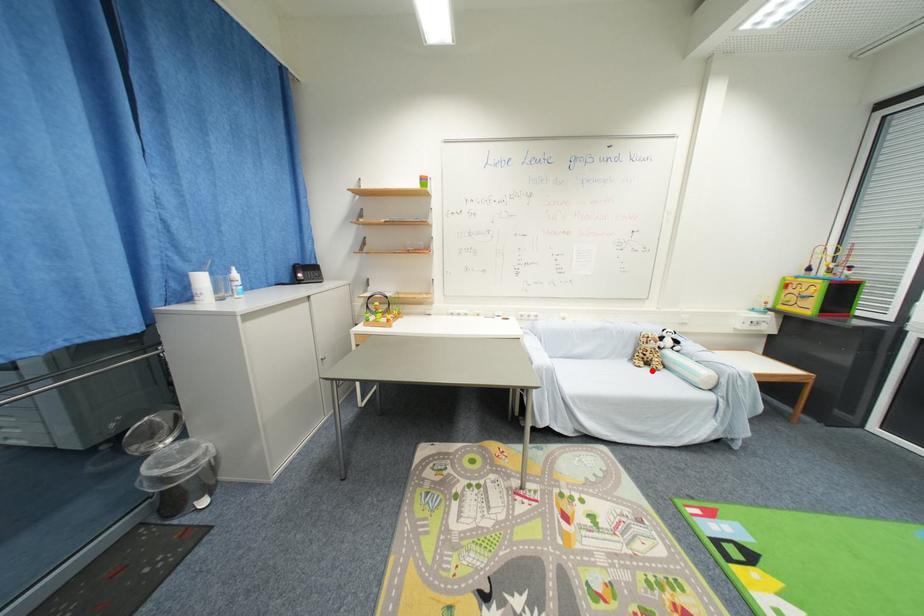
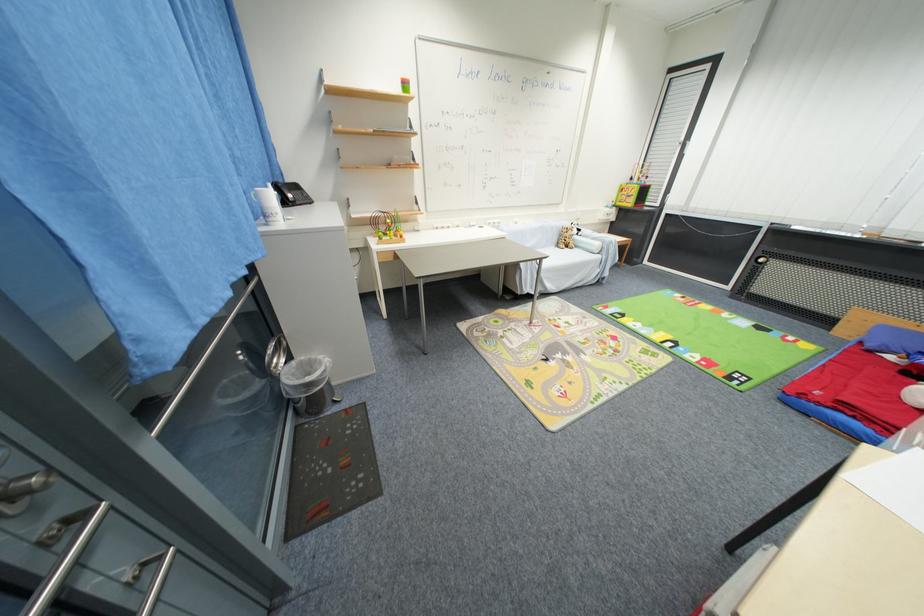
Question: I am providing you with two images of the same scene from different viewpoints. A red point is shown in image1. For the corresponding object point in image2, is it positioned nearer or farther from the camera?

Choices:
 (A) Nearer
 (B) Farther

Answer: (B)